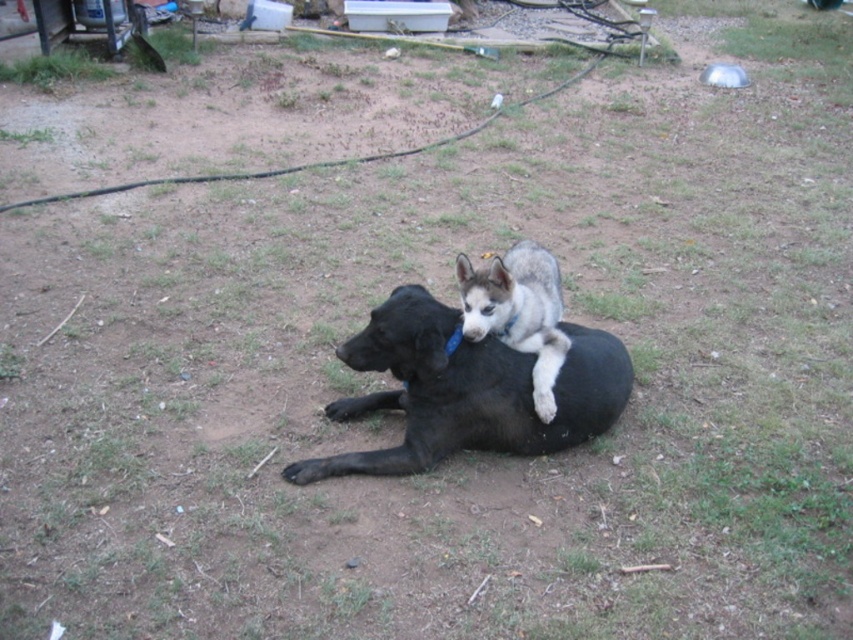
You are trying to take a photo of the black matte dog at center and the gray fur dog at center. The camera you are using has a minimum focus distance of 8 inches. Can you focus on both dogs at the same time?

The black matte dog at center and gray fur dog at center are 8.15 inches apart. Since the minimum focus distance is 8 inches, the camera can focus on both dogs as the distance between them is slightly more than the minimum requirement.

You are standing in the backyard and want to pick up two items located at point A and point B. Point A is at coordinates point [315,465] and point B is at coordinates point [490,296]. If you move towards both points, which one will you reach first?

Point A at coordinates point [315,465] is closer to you than point B at coordinates point [490,296], so you will reach point A first.

You are a photographer trying to capture a photo of both the black matte dog at center and the gray fur dog at center. If you want to frame them side by side in the photo without moving them, which dog should be positioned on the left side of the frame?

The black matte dog at center should be positioned on the left side of the frame because it is already to the left of the gray fur dog at center.